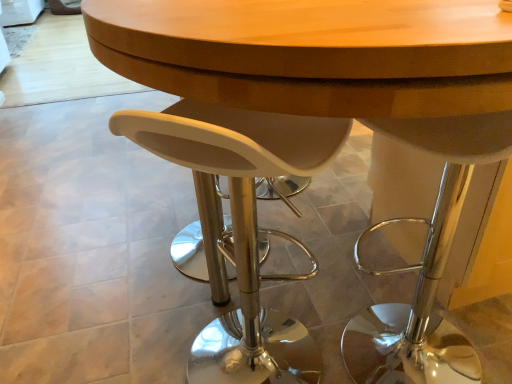
This screenshot has width=512, height=384. I want to click on vacant area situated to the left side of white plastic stool at center, so click(139, 336).